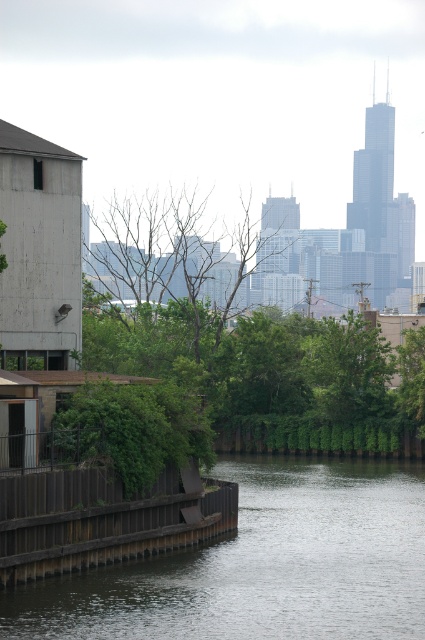
You are standing at the point labeled as point (260, 564) in the image. Based on the scene description, what type of surface are you currently standing on?

The point (260, 564) is on the dark gray concrete river at lower center, so you are standing on a concrete surface.

You are standing at the origin point in the image. Where is the dark gray concrete river at lower center located in terms of its 2D coordinates?

The dark gray concrete river at lower center is located at coordinates point (260, 564).